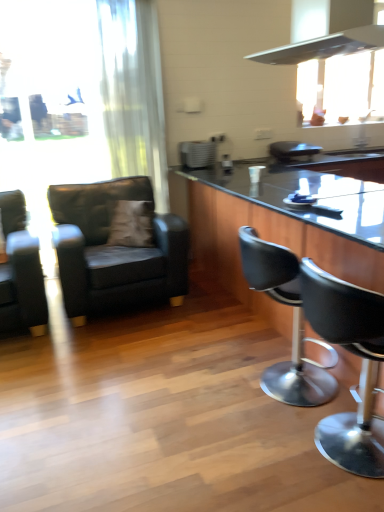
Question: Is brown suede pillow at center oriented towards matte black armchair at left, marked as the 3th chair in a right-to-left arrangement?

Choices:
 (A) no
 (B) yes

Answer: (B)

Question: From a real-world perspective, is brown suede pillow at center under matte black armchair at left, positioned as the second chair in left-to-right order?

Choices:
 (A) yes
 (B) no

Answer: (B)

Question: Is brown suede pillow at center touching matte black armchair at left, positioned as the second chair in left-to-right order?

Choices:
 (A) no
 (B) yes

Answer: (A)

Question: Is brown suede pillow at center behind matte black armchair at left, positioned as the second chair in left-to-right order?

Choices:
 (A) no
 (B) yes

Answer: (B)

Question: Is brown suede pillow at center to the left of matte black armchair at left, marked as the 3th chair in a right-to-left arrangement, from the viewer's perspective?

Choices:
 (A) yes
 (B) no

Answer: (B)

Question: From the image's perspective, relative to brown suede pillow at center, is white sheer curtain at left above or below?

Choices:
 (A) below
 (B) above

Answer: (B)

Question: In terms of height, does white sheer curtain at left look taller or shorter compared to brown suede pillow at center?

Choices:
 (A) short
 (B) tall

Answer: (B)

Question: Looking at the image, does white sheer curtain at left seem bigger or smaller compared to brown suede pillow at center?

Choices:
 (A) big
 (B) small

Answer: (A)

Question: From a real-world perspective, is white sheer curtain at left physically located above or below brown suede pillow at center?

Choices:
 (A) below
 (B) above

Answer: (B)

Question: In terms of width, does black glossy countertop at center look wider or thinner when compared to white sheer curtain at left?

Choices:
 (A) wide
 (B) thin

Answer: (A)

Question: Relative to white sheer curtain at left, is black glossy countertop at center in front or behind?

Choices:
 (A) front
 (B) behind

Answer: (B)

Question: In terms of size, does black glossy countertop at center appear bigger or smaller than white sheer curtain at left?

Choices:
 (A) big
 (B) small

Answer: (A)

Question: Do you think black glossy countertop at center is within white sheer curtain at left, or outside of it?

Choices:
 (A) inside
 (B) outside

Answer: (B)

Question: From their relative heights in the image, would you say black leather bar stool at center, the third chair from the left, is taller or shorter than satin silver toaster at center?

Choices:
 (A) short
 (B) tall

Answer: (B)

Question: In terms of size, does black leather bar stool at center, the third chair from the left, appear bigger or smaller than satin silver toaster at center?

Choices:
 (A) big
 (B) small

Answer: (A)